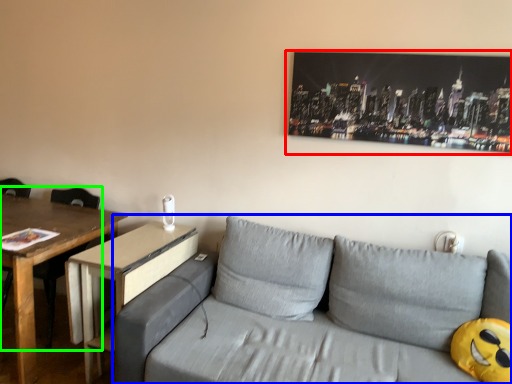
Question: Considering the real-world distances, which object is closest to picture frame (highlighted by a red box)? studio couch (highlighted by a blue box) or chair (highlighted by a green box).

Choices:
 (A) studio couch
 (B) chair

Answer: (A)